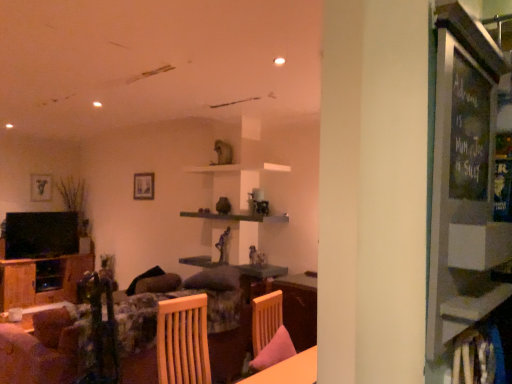
Question: Does wooden shelf at center have a greater width compared to matte black picture frame at upper left, marked as the second picture frame in a right-to-left arrangement?

Choices:
 (A) no
 (B) yes

Answer: (B)

Question: From a real-world perspective, is wooden shelf at center over matte black picture frame at upper left, placed as the first picture frame when sorted from back to front?

Choices:
 (A) no
 (B) yes

Answer: (A)

Question: Is wooden shelf at center taller than matte black picture frame at upper left, the 1th picture frame when ordered from left to right?

Choices:
 (A) yes
 (B) no

Answer: (B)

Question: Does wooden shelf at center appear on the left side of matte black picture frame at upper left, marked as the second picture frame in a right-to-left arrangement?

Choices:
 (A) yes
 (B) no

Answer: (B)

Question: Is wooden shelf at center smaller than matte black picture frame at upper left, placed as the first picture frame when sorted from back to front?

Choices:
 (A) no
 (B) yes

Answer: (A)

Question: Visually, is wooden table at lower center positioned to the left or to the right of matte black picture frame at upper left, marked as the second picture frame in a right-to-left arrangement?

Choices:
 (A) left
 (B) right

Answer: (B)

Question: Based on their sizes in the image, would you say wooden table at lower center is bigger or smaller than matte black picture frame at upper left, the 1th picture frame when ordered from left to right?

Choices:
 (A) big
 (B) small

Answer: (A)

Question: Is wooden table at lower center spatially inside matte black picture frame at upper left, the 1th picture frame when ordered from left to right, or outside of it?

Choices:
 (A) outside
 (B) inside

Answer: (A)

Question: Considering the positions of wooden table at lower center and matte black picture frame at upper left, the 1th picture frame when ordered from left to right, in the image, is wooden table at lower center wider or thinner than matte black picture frame at upper left, the 1th picture frame when ordered from left to right,?

Choices:
 (A) thin
 (B) wide

Answer: (B)

Question: Would you say wooden cabinet at left is inside or outside matte black picture frame at upper left, the 1th picture frame when ordered from left to right?

Choices:
 (A) outside
 (B) inside

Answer: (A)

Question: Looking at their shapes, would you say wooden cabinet at left is wider or thinner than matte black picture frame at upper left, placed as the first picture frame when sorted from back to front?

Choices:
 (A) wide
 (B) thin

Answer: (A)

Question: Relative to matte black picture frame at upper left, marked as the second picture frame in a right-to-left arrangement, is wooden cabinet at left in front or behind?

Choices:
 (A) behind
 (B) front

Answer: (B)

Question: Based on their sizes in the image, would you say wooden cabinet at left is bigger or smaller than matte black picture frame at upper left, which appears as the second picture frame when viewed from the front?

Choices:
 (A) big
 (B) small

Answer: (A)

Question: From a real-world perspective, relative to wooden shelf at center, is matte black picture frame at upper left, placed as the first picture frame when sorted from back to front, vertically above or below?

Choices:
 (A) below
 (B) above

Answer: (B)

Question: In terms of width, does matte black picture frame at upper left, marked as the second picture frame in a right-to-left arrangement, look wider or thinner when compared to wooden shelf at center?

Choices:
 (A) wide
 (B) thin

Answer: (B)